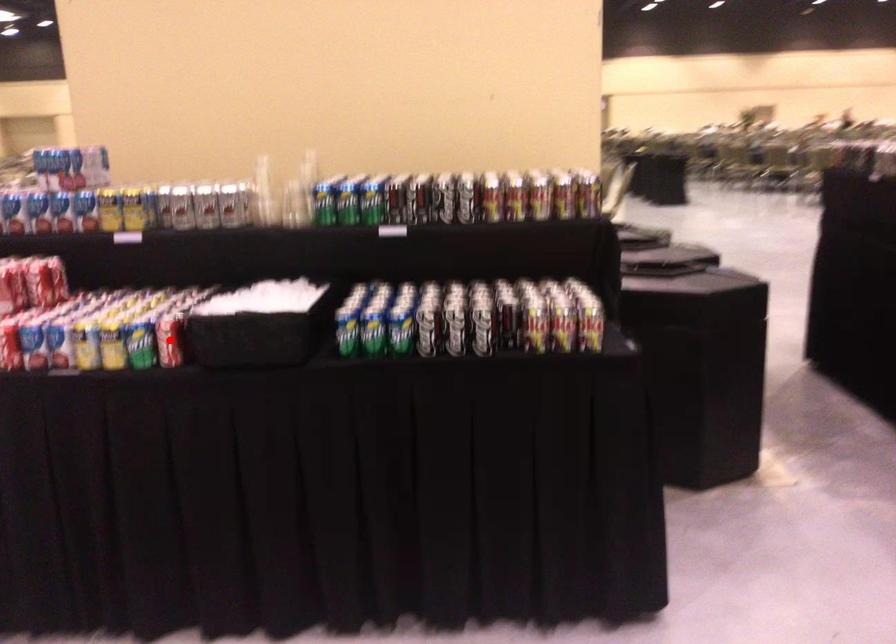
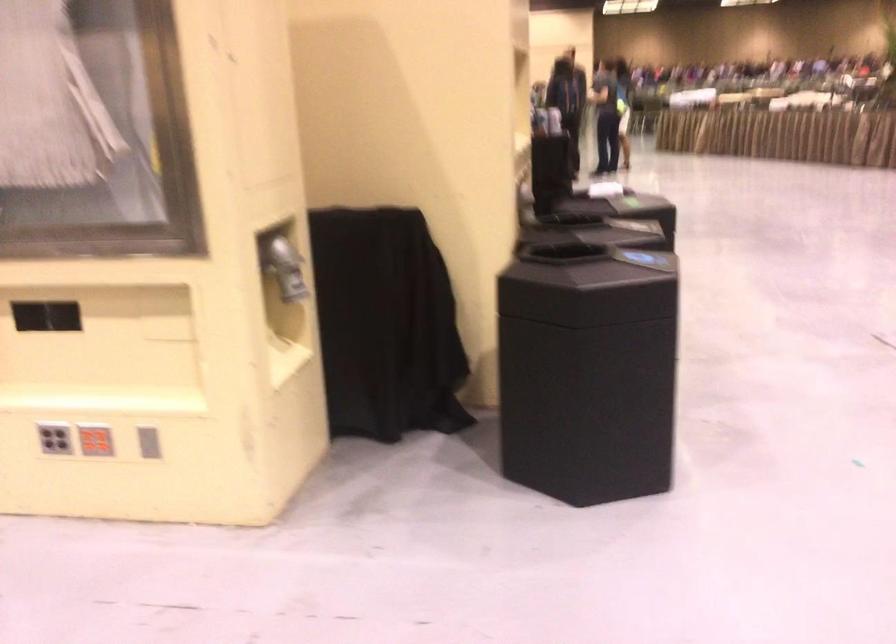
Question: I am providing you with two images of the same scene from different viewpoints. A red point is marked on the first image. Can you still see the location of the red point in image 2?

Choices:
 (A) Yes
 (B) No

Answer: (B)